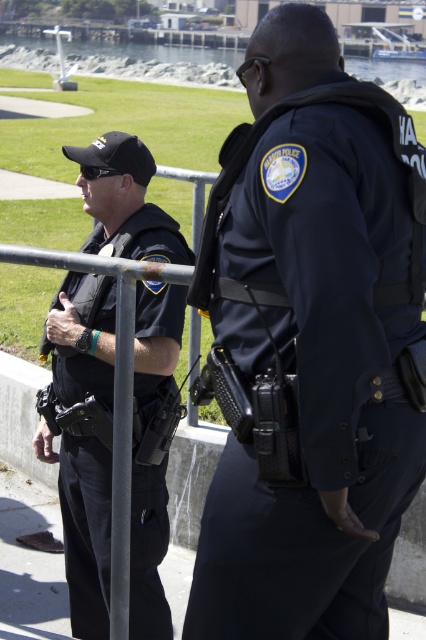
Is black matte uniform at center closer to the viewer compared to metallic gray pole at center?

No, it is behind metallic gray pole at center.

Who is more forward, (109,500) or (124,564)?

Point (124,564) is more forward.

The width and height of the screenshot is (426, 640). I want to click on black matte uniform at center, so click(x=83, y=518).

Who is higher up, dark blue uniform at center or metallic gray pole at center?

dark blue uniform at center is above.

Is point (288, 189) closer to camera compared to point (123, 625)?

Yes.

Which is in front, point (227, 531) or point (123, 397)?

Positioned in front is point (227, 531).

This screenshot has width=426, height=640. Find the location of `dark blue uniform at center`. dark blue uniform at center is located at coordinates (310, 346).

From the picture: Can you confirm if dark blue uniform at center is positioned to the left of black matte uniform at center?

Incorrect, dark blue uniform at center is not on the left side of black matte uniform at center.

Is dark blue uniform at center shorter than black matte uniform at center?

Yes.

Measure the distance between point (x=337, y=296) and camera.

1.99 meters

The height and width of the screenshot is (640, 426). What are the coordinates of `dark blue uniform at center` in the screenshot? It's located at pyautogui.click(x=310, y=346).